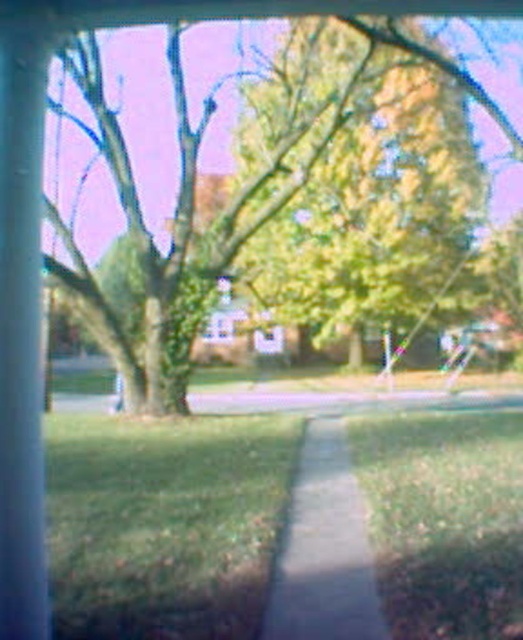
Question: Does green grass at lower center come in front of concrete sidewalk at center?

Choices:
 (A) no
 (B) yes

Answer: (B)

Question: Which of the following is the closest to the observer?

Choices:
 (A) green leafy tree at upper left
 (B) green grass at lower center

Answer: (A)

Question: Which is nearer to the green grass at lower left?

Choices:
 (A) green grass at lower center
 (B) green leafy tree at upper left

Answer: (A)

Question: Which point is closer to the camera taking this photo?

Choices:
 (A) (301, 51)
 (B) (520, 582)

Answer: (B)

Question: Is green grass at lower left to the left of green grass at lower center from the viewer's perspective?

Choices:
 (A) yes
 (B) no

Answer: (A)

Question: Does green grass at lower left have a lesser width compared to green leafy tree at upper left?

Choices:
 (A) yes
 (B) no

Answer: (A)